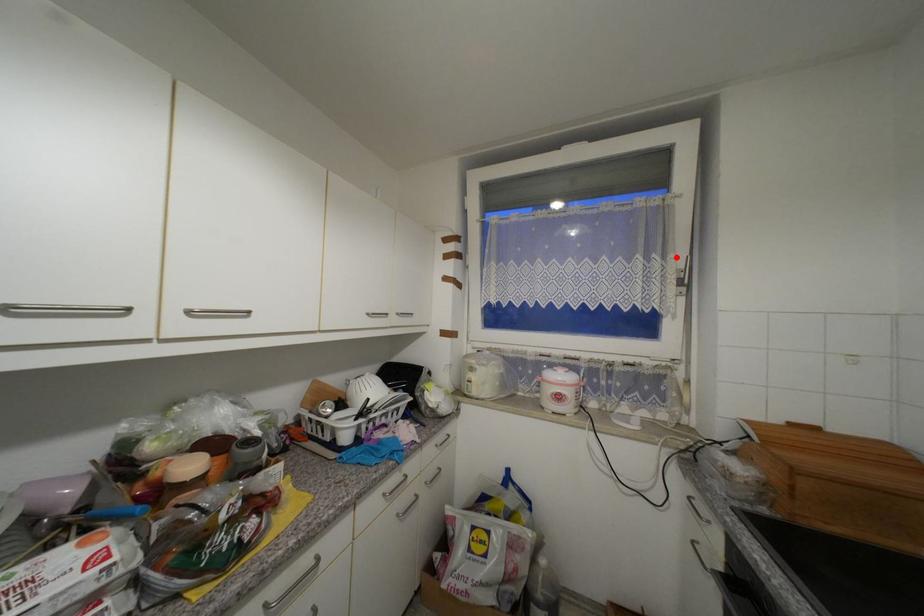
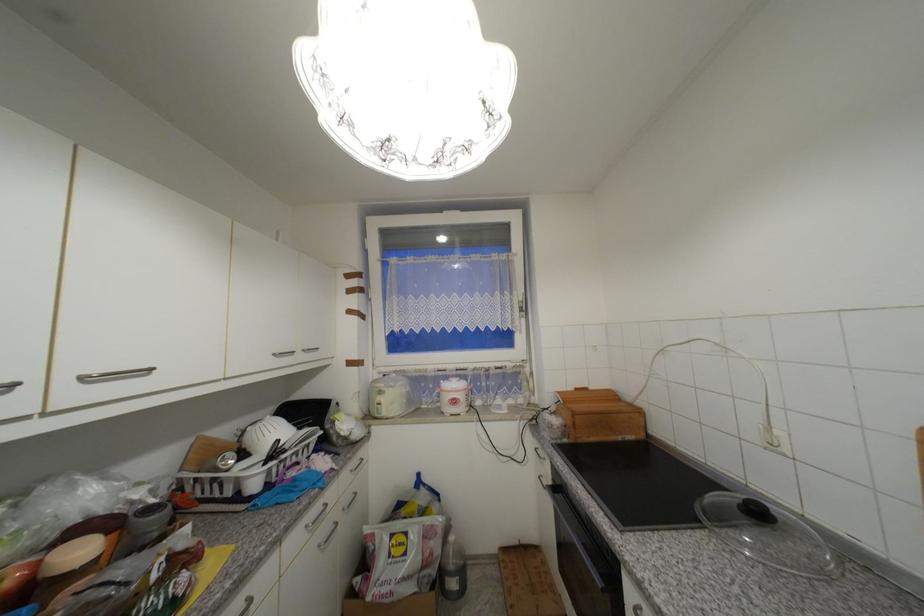
Where in the second image is the point corresponding to the highlighted location from the first image?

(520, 294)